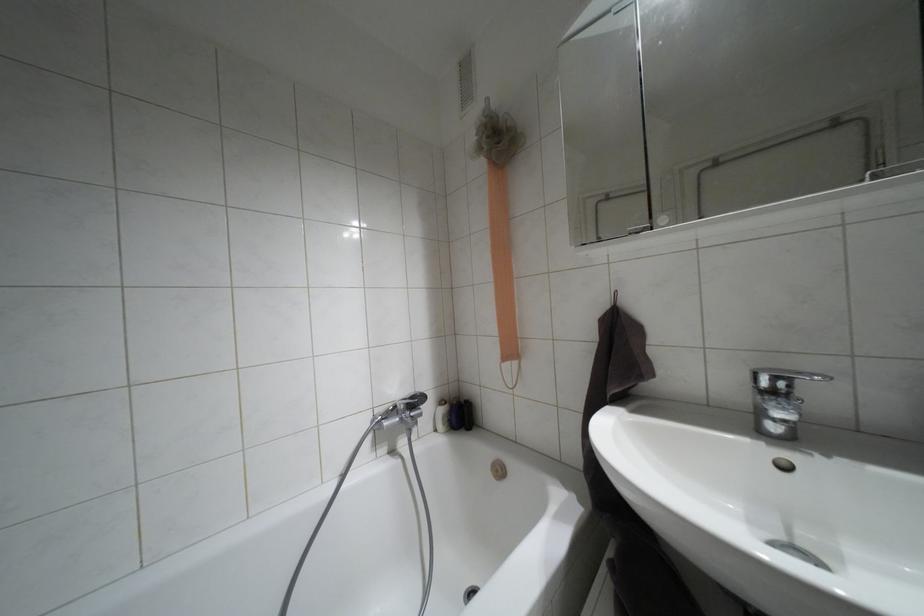
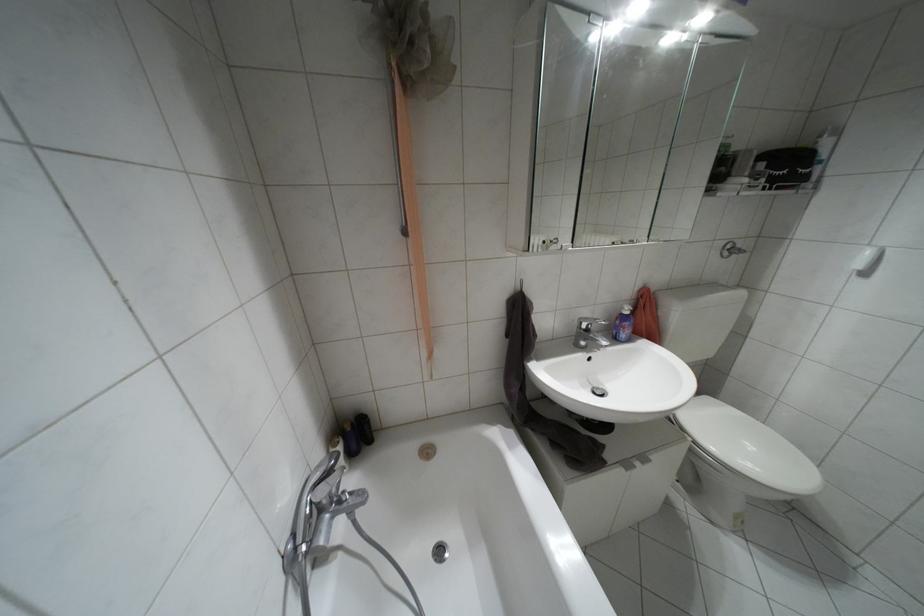
In the second image, find the point that corresponds to pixel 772 392 in the first image.

(587, 330)